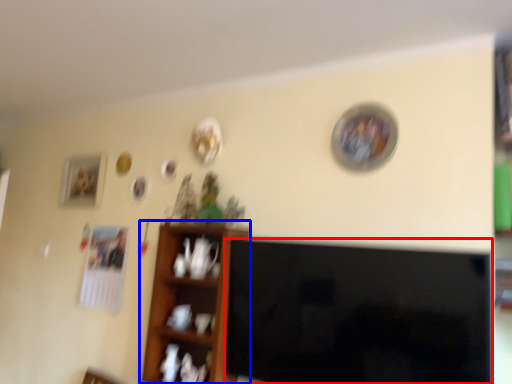
Question: Which of the following is the farthest to the observer, television (highlighted by a red box) or shelf (highlighted by a blue box)?

Choices:
 (A) television
 (B) shelf

Answer: (B)